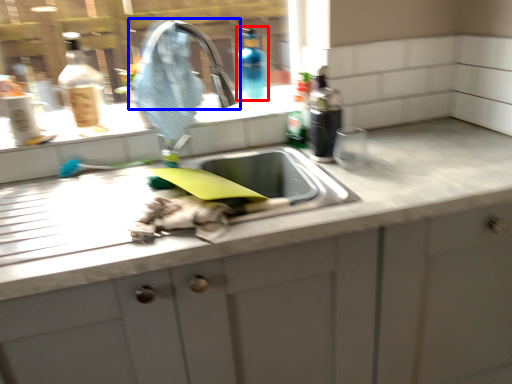
Question: Which object is closer to the camera taking this photo, bottle (highlighted by a red box) or tap (highlighted by a blue box)?

Choices:
 (A) bottle
 (B) tap

Answer: (B)